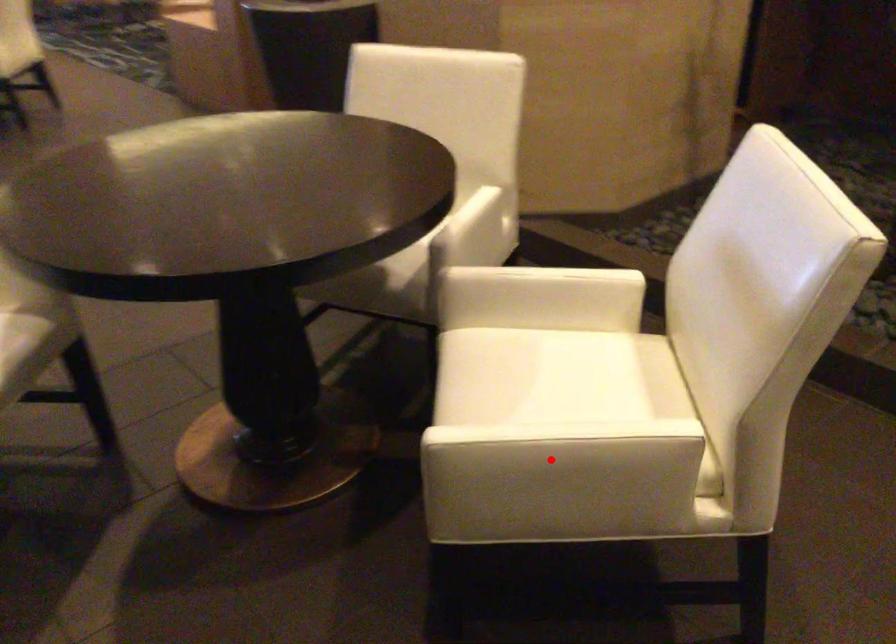
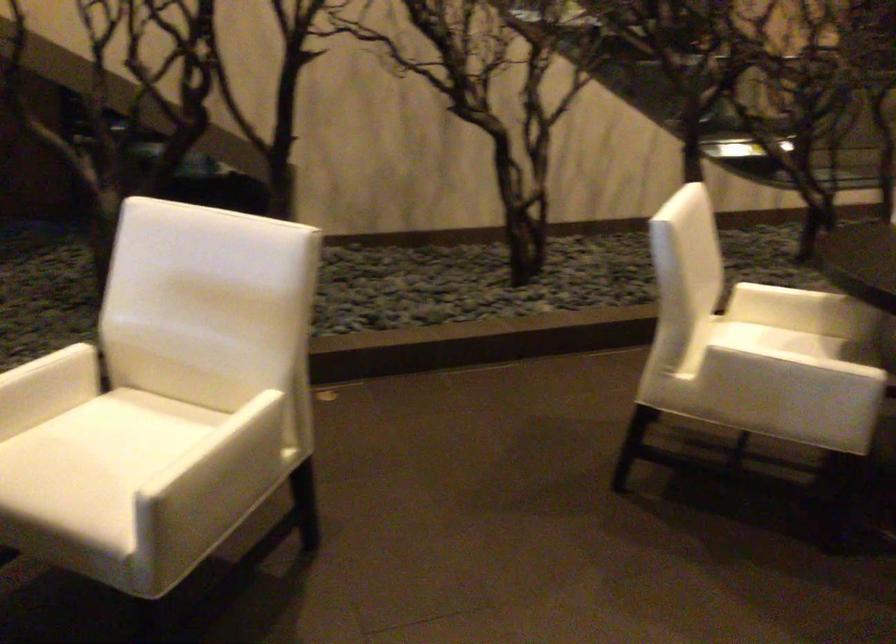
Question: I am providing you with two images of the same scene from different viewpoints. Image1 has a red point marked. In image2, the corresponding 3D location appears at what relative position? Reply with the corresponding letter.

Choices:
 (A) Closer
 (B) Farther

Answer: (B)